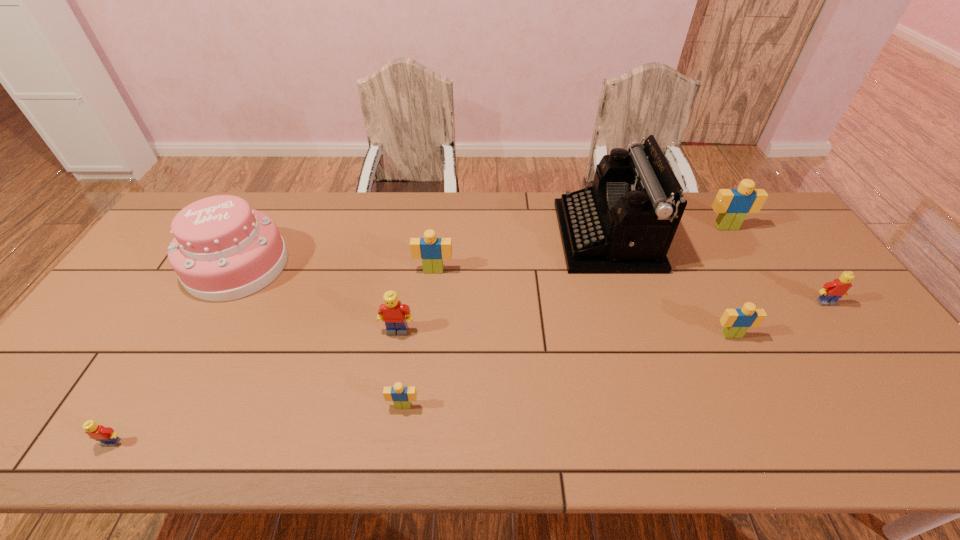
You are a GUI agent. You are given a task and a screenshot of the screen. Output one action in this format:
    pyautogui.click(x=<x>, y=<y>)
    Task: Click on the vacant space positioned on the right of the birthday cake
    This screenshot has width=960, height=540.
    Given the screenshot: What is the action you would take?
    pyautogui.click(x=418, y=266)

Find the location of a particular element. Image resolution: width=960 pixels, height=540 pixels. vacant space located on the face of the second Lego from right to left is located at coordinates (782, 319).

You are a GUI agent. You are given a task and a screenshot of the screen. Output one action in this format:
    pyautogui.click(x=<x>, y=<y>)
    Task: Click on the vacant space located on the face of the second farthest beige Lego
    The height and width of the screenshot is (540, 960).
    Given the screenshot: What is the action you would take?
    pyautogui.click(x=431, y=297)

Where is `blank space located 0.170m on the front-facing side of the second nearest yellow Lego`? This screenshot has height=540, width=960. blank space located 0.170m on the front-facing side of the second nearest yellow Lego is located at coordinates (387, 395).

Locate an element on the screen. This screenshot has height=540, width=960. vacant space located 0.250m on the face of the second beige Lego from right to left is located at coordinates (779, 431).

This screenshot has height=540, width=960. Find the location of `free spot located on the front-facing side of the second biggest yellow Lego`. free spot located on the front-facing side of the second biggest yellow Lego is located at coordinates (845, 329).

Locate an element on the screen. free spot located on the face of the second nearest Lego is located at coordinates (398, 440).

The width and height of the screenshot is (960, 540). Find the location of `typewriter that is positioned at the far edge`. typewriter that is positioned at the far edge is located at coordinates click(624, 223).

Where is `birthday cake positioned at the far edge`? Image resolution: width=960 pixels, height=540 pixels. birthday cake positioned at the far edge is located at coordinates (223, 250).

The height and width of the screenshot is (540, 960). What are the coordinates of `Lego present at the far edge` in the screenshot? It's located at (732, 205).